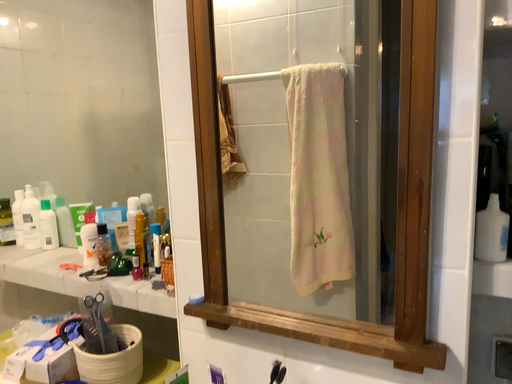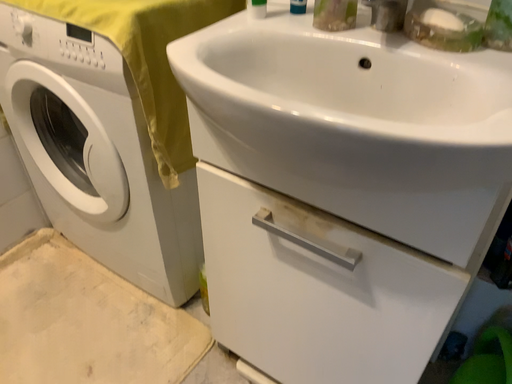
Question: How did the camera likely rotate when shooting the video?

Choices:
 (A) rotated downward
 (B) rotated upward

Answer: (A)